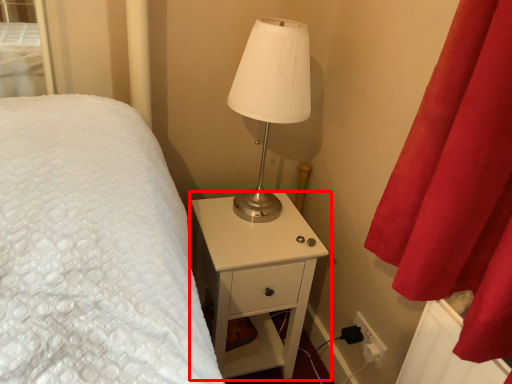
Question: From the image's perspective, what is the correct spatial positioning of nightstand (annotated by the red box) in reference to lamp?

Choices:
 (A) below
 (B) above

Answer: (A)